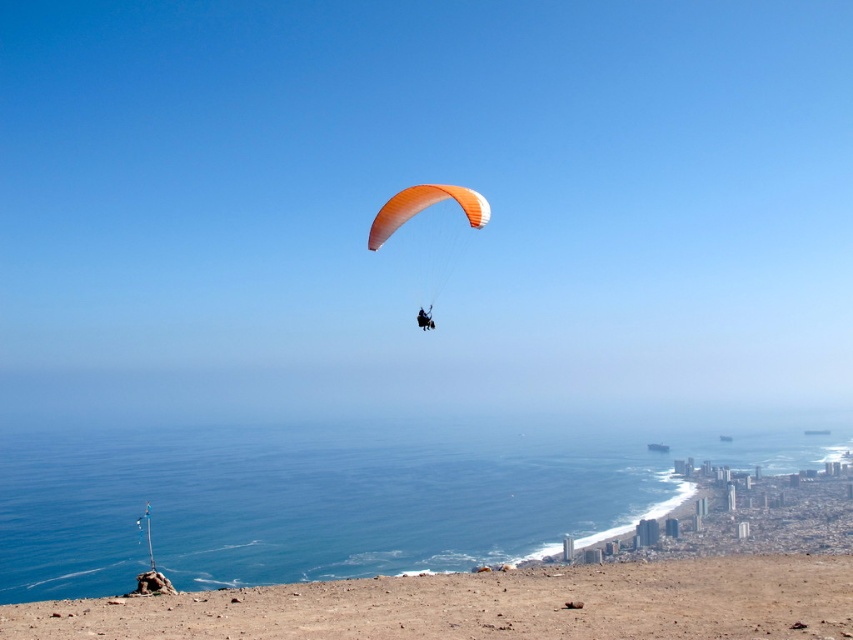
In the scene shown: Does brown sandy beach at lower center appear on the left side of orange fabric parachute at upper center?

Incorrect, brown sandy beach at lower center is not on the left side of orange fabric parachute at upper center.

What do you see at coordinates (486, 604) in the screenshot? The image size is (853, 640). I see `brown sandy beach at lower center` at bounding box center [486, 604].

Where is `brown sandy beach at lower center`? brown sandy beach at lower center is located at coordinates (486, 604).

Does blue water at lower center appear under brown sandy beach at lower center?

Indeed, blue water at lower center is positioned under brown sandy beach at lower center.

Which is in front, point (326, 545) or point (612, 563)?

Positioned in front is point (612, 563).

Measure the distance between blue water at lower center and camera.

blue water at lower center and camera are 629.52 meters apart from each other.

Identify the location of blue water at lower center. The height and width of the screenshot is (640, 853). (335, 497).

Based on the photo, is blue water at lower center to the right of orange fabric parachute at upper center from the viewer's perspective?

In fact, blue water at lower center is to the left of orange fabric parachute at upper center.

Describe the element at coordinates (335, 497) in the screenshot. I see `blue water at lower center` at that location.

Measure the distance between blue water at lower center and camera.

They are 629.52 meters apart.

This screenshot has height=640, width=853. I want to click on blue water at lower center, so click(335, 497).